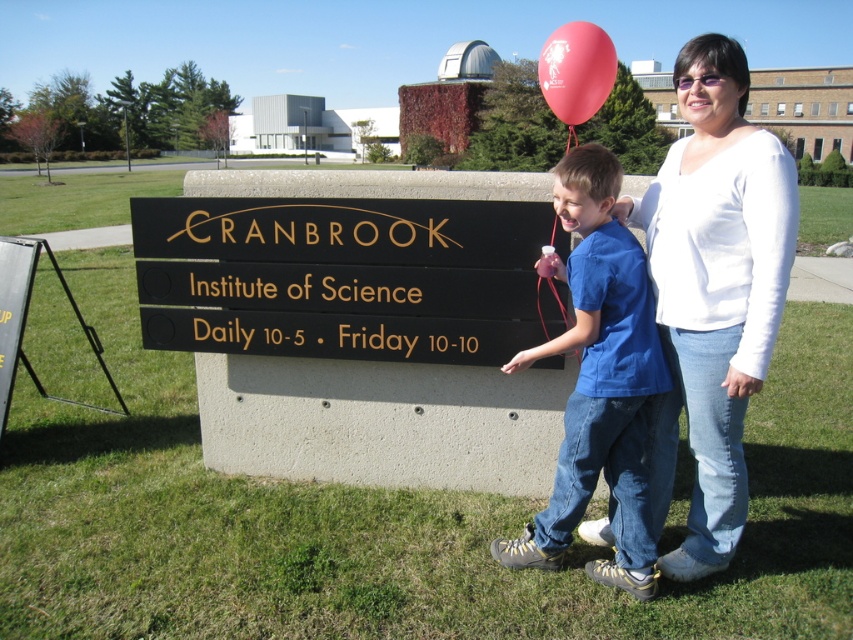
What is the exact coordinate of the black polished wood sign at center?

The black polished wood sign at center is located at point (343, 276).

Two people are standing near the Cranbrook Institute of Science sign. The adult is on the right and the child is on the left. The point between them is at coordinates point (697, 506). If the adult wants to hand the child a red balloon attached to the sign, can they reach each other without moving?

The adult and the child are 3.14 meters apart, which is farther than the typical human arm length of around 1.5 meters. Therefore, the adult cannot reach the child without moving.

You are standing in front of the Cranbrook Institute of Science sign. You see a point marked at coordinates [712,291]. What object does this point correspond to?

The point at coordinates [712,291] corresponds to the white smooth shirt at upper right.